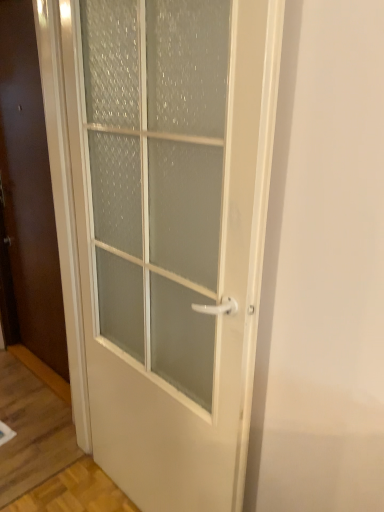
Image resolution: width=384 pixels, height=512 pixels. Describe the element at coordinates (173, 239) in the screenshot. I see `white frosted glass door at center, which is the first door from right to left` at that location.

What is the approximate width of white frosted glass door at center, the first door from the front?

It is 11.07 centimeters.

Find the location of a particular element. white frosted glass door at center, which is the first door from right to left is located at coordinates (173, 239).

The image size is (384, 512). I want to click on white glossy door at center, which is counted as the first door, starting from the left, so click(29, 190).

The height and width of the screenshot is (512, 384). What do you see at coordinates (29, 190) in the screenshot?
I see `white glossy door at center, which is the 2th door in right-to-left order` at bounding box center [29, 190].

At what (x,y) coordinates should I click in order to perform the action: click on white frosted glass door at center, which is the first door from right to left. Please return your answer as a coordinate pair (x, y). Looking at the image, I should click on (173, 239).

Which is more to the right, white glossy door at center, the first door from the back, or white frosted glass door at center, which is counted as the second door, starting from the left?

From the viewer's perspective, white frosted glass door at center, which is counted as the second door, starting from the left, appears more on the right side.

From the picture: Which object is further away from the camera taking this photo, white glossy door at center, the first door from the back, or white frosted glass door at center, acting as the second door starting from the back?

Positioned behind is white glossy door at center, the first door from the back.

Between point (14, 263) and point (262, 192), which one is positioned in front?

The point (262, 192) is closer.

From the image's perspective, between white glossy door at center, which is counted as the first door, starting from the left, and white frosted glass door at center, acting as the second door starting from the back, who is located below?

white frosted glass door at center, acting as the second door starting from the back, is shown below in the image.

From a real-world perspective, who is located lower, white glossy door at center, which is the 2th door in right-to-left order, or white frosted glass door at center, which is counted as the second door, starting from the left?

white frosted glass door at center, which is counted as the second door, starting from the left, is physically lower.

Does white glossy door at center, positioned as the second door in front-to-back order, have a greater width compared to white frosted glass door at center, which is counted as the second door, starting from the left?

In fact, white glossy door at center, positioned as the second door in front-to-back order, might be narrower than white frosted glass door at center, which is counted as the second door, starting from the left.

Can you confirm if white glossy door at center, which is counted as the first door, starting from the left, is taller than white frosted glass door at center, the first door from the front?

Yes, white glossy door at center, which is counted as the first door, starting from the left, is taller than white frosted glass door at center, the first door from the front.

Looking at this image, is white glossy door at center, which is counted as the first door, starting from the left, bigger or smaller than white frosted glass door at center, which is the first door from right to left?

Considering their sizes, white glossy door at center, which is counted as the first door, starting from the left, takes up less space than white frosted glass door at center, which is the first door from right to left.

Does white glossy door at center, positioned as the second door in front-to-back order, contain white frosted glass door at center, the first door from the front?

No.

Is white glossy door at center, the first door from the back, with white frosted glass door at center, which is the first door from right to left?

They are not placed beside each other.

Is white glossy door at center, the first door from the back, turned away from white frosted glass door at center, which is counted as the second door, starting from the left?

No, white glossy door at center, the first door from the back, is not facing the opposite direction of white frosted glass door at center, which is counted as the second door, starting from the left.

Find the location of `door behind the white frosted glass door at center, acting as the second door starting from the back`. door behind the white frosted glass door at center, acting as the second door starting from the back is located at coordinates (29, 190).

Considering the positions of objects white frosted glass door at center, which is counted as the second door, starting from the left, and white glossy door at center, which is the 2th door in right-to-left order, in the image provided, who is more to the right, white frosted glass door at center, which is counted as the second door, starting from the left, or white glossy door at center, which is the 2th door in right-to-left order,?

white frosted glass door at center, which is counted as the second door, starting from the left.

Which object is more forward, white frosted glass door at center, which is counted as the second door, starting from the left, or white glossy door at center, which is the 2th door in right-to-left order?

Positioned in front is white frosted glass door at center, which is counted as the second door, starting from the left.

Which point is more distant from viewer, [235,458] or [30,232]?

The point [30,232] is more distant.

From the image's perspective, who appears lower, white frosted glass door at center, which is the first door from right to left, or white glossy door at center, the first door from the back?

white frosted glass door at center, which is the first door from right to left, from the image's perspective.

From a real-world perspective, who is located higher, white frosted glass door at center, which is counted as the second door, starting from the left, or white glossy door at center, which is counted as the first door, starting from the left?

white glossy door at center, which is counted as the first door, starting from the left.

Between white frosted glass door at center, acting as the second door starting from the back, and white glossy door at center, which is counted as the first door, starting from the left, which one has smaller width?

With smaller width is white glossy door at center, which is counted as the first door, starting from the left.

From their relative heights in the image, would you say white frosted glass door at center, which is counted as the second door, starting from the left, is taller or shorter than white glossy door at center, positioned as the second door in front-to-back order?

white frosted glass door at center, which is counted as the second door, starting from the left, is shorter than white glossy door at center, positioned as the second door in front-to-back order.

Based on their sizes in the image, would you say white frosted glass door at center, the first door from the front, is bigger or smaller than white glossy door at center, positioned as the second door in front-to-back order?

Considering their sizes, white frosted glass door at center, the first door from the front, takes up more space than white glossy door at center, positioned as the second door in front-to-back order.

Would you say white frosted glass door at center, acting as the second door starting from the back, is outside white glossy door at center, which is the 2th door in right-to-left order?

Yes, white frosted glass door at center, acting as the second door starting from the back, is located beyond the bounds of white glossy door at center, which is the 2th door in right-to-left order.

Is white frosted glass door at center, which is counted as the second door, starting from the left, far away from white glossy door at center, positioned as the second door in front-to-back order?

white frosted glass door at center, which is counted as the second door, starting from the left, is near white glossy door at center, positioned as the second door in front-to-back order, not far away.

Is white frosted glass door at center, the first door from the front, looking in the opposite direction of white glossy door at center, which is counted as the first door, starting from the left?

No, white frosted glass door at center, the first door from the front, is not facing the opposite direction of white glossy door at center, which is counted as the first door, starting from the left.

This screenshot has height=512, width=384. In the image, there is a white glossy door at center, positioned as the second door in front-to-back order. Find the location of `door below it (from a real-world perspective)`. door below it (from a real-world perspective) is located at coordinates (173, 239).

Image resolution: width=384 pixels, height=512 pixels. In order to click on door lying behind the white frosted glass door at center, which is counted as the second door, starting from the left in this screenshot , I will do `click(29, 190)`.

At what (x,y) coordinates should I click in order to perform the action: click on door in front of the white glossy door at center, which is the 2th door in right-to-left order. Please return your answer as a coordinate pair (x, y). Image resolution: width=384 pixels, height=512 pixels. Looking at the image, I should click on (173, 239).